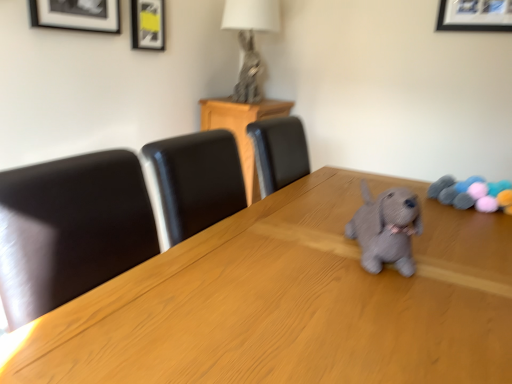
Image resolution: width=512 pixels, height=384 pixels. What do you see at coordinates (386, 229) in the screenshot? I see `gray knitted dog at center` at bounding box center [386, 229].

This screenshot has height=384, width=512. Find the location of `gray knitted dog at center`. gray knitted dog at center is located at coordinates (386, 229).

The height and width of the screenshot is (384, 512). I want to click on wooden table at center, so click(293, 303).

In order to face gray knitted stuffed animal at right, should I rotate leftwards or rightwards?

It's best to rotate right around 26.644 degrees.

Locate an element on the screen. This screenshot has width=512, height=384. gray knitted dog at center is located at coordinates tap(386, 229).

From a real-world perspective, is black leather chair at center beneath gray knitted stuffed animal at right?

Yes, from a real-world perspective, black leather chair at center is under gray knitted stuffed animal at right.

Which is correct: black leather chair at center is inside gray knitted stuffed animal at right, or outside of it?

black leather chair at center is not enclosed by gray knitted stuffed animal at right.

Is black leather chair at center bigger or smaller than gray knitted stuffed animal at right?

Clearly, black leather chair at center is larger in size than gray knitted stuffed animal at right.

Is black leather chair at center in front of or behind matte black picture frame at upper left, acting as the 1th picture frame starting from the back, in the image?

Clearly, black leather chair at center is in front of matte black picture frame at upper left, acting as the 1th picture frame starting from the back.

Is black leather chair at center positioned with its back to matte black picture frame at upper left, acting as the second picture frame starting from the front?

That's not correct — black leather chair at center is not looking away from matte black picture frame at upper left, acting as the second picture frame starting from the front.

At what (x,y) coordinates should I click in order to perform the action: click on the 2nd picture frame above when counting from the black leather chair at center (from the image's perspective). Please return your answer as a coordinate pair (x, y). The height and width of the screenshot is (384, 512). Looking at the image, I should click on (148, 24).

Consider the image. Is wooden table at center to the right of black leather chair at center from the viewer's perspective?

Yes.

Where is `chair that appears behind the wooden table at center`? The width and height of the screenshot is (512, 384). chair that appears behind the wooden table at center is located at coordinates (279, 152).

Based on the photo, is wooden table at center positioned with its back to black leather chair at center?

No, wooden table at center is not facing the opposite direction of black leather chair at center.

From a real-world perspective, is wooden table at center positioned above or below black leather chair at center?

wooden table at center is situated lower than black leather chair at center in the real world.

Considering the sizes of objects gray knitted stuffed animal at right and matte black picture frame at upper left, the 2th picture frame viewed from the back, in the image provided, who is taller, gray knitted stuffed animal at right or matte black picture frame at upper left, the 2th picture frame viewed from the back,?

With more height is matte black picture frame at upper left, the 2th picture frame viewed from the back.

Considering the relative positions of gray knitted stuffed animal at right and matte black picture frame at upper left, the 2th picture frame viewed from the back, in the image provided, is gray knitted stuffed animal at right to the right of matte black picture frame at upper left, the 2th picture frame viewed from the back, from the viewer's perspective?

Yes, gray knitted stuffed animal at right is to the right of matte black picture frame at upper left, the 2th picture frame viewed from the back.

From the image's perspective, which one is positioned lower, gray knitted stuffed animal at right or matte black picture frame at upper left, which is the first picture frame in front-to-back order?

From the image's view, gray knitted stuffed animal at right is below.

Would you say gray knitted dog at center is outside gray knitted stuffed animal at right?

gray knitted dog at center lies outside gray knitted stuffed animal at right's area.

Which is less distant, (370, 206) or (509, 188)?

Point (370, 206) is closer to the camera than point (509, 188).

You are a GUI agent. You are given a task and a screenshot of the screen. Output one action in this format:
    pyautogui.click(x=<x>, y=<y>)
    Task: Click on the dog below the gray knitted stuffed animal at right (from the image's perspective)
    The image size is (512, 384).
    Given the screenshot: What is the action you would take?
    tap(386, 229)

From the picture: From the image's perspective, would you say gray knitted dog at center is positioned over gray knitted stuffed animal at right?

No.

Who is bigger, black leather chair at center or gray knitted dog at center?

Bigger between the two is black leather chair at center.

How different are the orientations of black leather chair at center and gray knitted dog at center in degrees?

64.3 degrees.

Is gray knitted dog at center at the back of black leather chair at center?

No.

Who is taller, black leather chair at center or gray knitted dog at center?

black leather chair at center is taller.

Would you say wooden table at center is a long distance from matte black picture frame at upper left, which is the first picture frame in front-to-back order?

Indeed, wooden table at center is not near matte black picture frame at upper left, which is the first picture frame in front-to-back order.

Considering the relative sizes of wooden table at center and matte black picture frame at upper left, which ranks as the first picture frame in left-to-right order, in the image provided, is wooden table at center taller than matte black picture frame at upper left, which ranks as the first picture frame in left-to-right order,?

Indeed, wooden table at center has a greater height compared to matte black picture frame at upper left, which ranks as the first picture frame in left-to-right order.

Looking at this image, is wooden table at center positioned beyond the bounds of matte black picture frame at upper left, the second picture frame from the right?

Absolutely, wooden table at center is external to matte black picture frame at upper left, the second picture frame from the right.

Looking at this image, measure the distance from wooden table at center to matte black picture frame at upper left, the 2th picture frame viewed from the back.

wooden table at center and matte black picture frame at upper left, the 2th picture frame viewed from the back, are 4.33 feet apart.

This screenshot has width=512, height=384. In the image, there is a black leather chair at center. Identify the location of toy below it (from the image's perspective). (473, 193).

Find the location of a particular element. The image size is (512, 384). chair located in front of the matte black picture frame at upper left, which is counted as the 1th picture frame, starting from the right is located at coordinates (279, 152).

Consider the image. Considering their positions, is metallic silver rabbit at upper center positioned further to black leather chair at center than gray knitted dog at center?

metallic silver rabbit at upper center is further to black leather chair at center.

From the image, which object appears to be farther from black leather chair at center, matte black picture frame at upper left, the second picture frame from the right, or gray knitted dog at center?

matte black picture frame at upper left, the second picture frame from the right, lies further to black leather chair at center than the other object.

Estimate the real-world distances between objects in this image. Which object is closer to black leather chair at center, metallic silver rabbit at upper center or gray knitted stuffed animal at right?

Based on the image, gray knitted stuffed animal at right appears to be nearer to black leather chair at center.

Which object lies further to the anchor point matte black picture frame at upper left, acting as the 1th picture frame starting from the back, gray knitted dog at center or metallic silver rabbit at upper center?

gray knitted dog at center is further to matte black picture frame at upper left, acting as the 1th picture frame starting from the back.

Which object lies further to the anchor point black leather chair at center, gray knitted dog at center or gray knitted stuffed animal at right?

gray knitted stuffed animal at right.

When comparing their distances from matte black picture frame at upper left, which is counted as the 1th picture frame, starting from the right, does gray knitted stuffed animal at right or wooden table at center seem closer?

Based on the image, wooden table at center appears to be nearer to matte black picture frame at upper left, which is counted as the 1th picture frame, starting from the right.

Estimate the real-world distances between objects in this image. Which object is closer to matte black picture frame at upper left, arranged as the second picture frame when viewed from the left, metallic silver rabbit at upper center or wooden table at center?

metallic silver rabbit at upper center lies closer to matte black picture frame at upper left, arranged as the second picture frame when viewed from the left, than the other object.

Looking at the image, which one is located closer to matte black picture frame at upper left, the second picture frame from the right, matte black picture frame at upper left, acting as the 1th picture frame starting from the back, or black leather chair at center?

Based on the image, matte black picture frame at upper left, acting as the 1th picture frame starting from the back, appears to be nearer to matte black picture frame at upper left, the second picture frame from the right.

You are a GUI agent. You are given a task and a screenshot of the screen. Output one action in this format:
    pyautogui.click(x=<x>, y=<y>)
    Task: Click on the chair situated between matte black picture frame at upper left, the 2th picture frame viewed from the back, and gray knitted dog at center from left to right
    The width and height of the screenshot is (512, 384).
    Given the screenshot: What is the action you would take?
    pyautogui.click(x=279, y=152)

Where is `dog between matte black picture frame at upper left, which is the first picture frame in front-to-back order, and gray knitted stuffed animal at right, in the horizontal direction`? dog between matte black picture frame at upper left, which is the first picture frame in front-to-back order, and gray knitted stuffed animal at right, in the horizontal direction is located at coordinates (386, 229).

You are a GUI agent. You are given a task and a screenshot of the screen. Output one action in this format:
    pyautogui.click(x=<x>, y=<y>)
    Task: Click on the picture frame positioned between matte black picture frame at upper left, which ranks as the first picture frame in left-to-right order, and metallic silver rabbit at upper center from near to far
    The image size is (512, 384).
    Given the screenshot: What is the action you would take?
    pyautogui.click(x=148, y=24)

Image resolution: width=512 pixels, height=384 pixels. I want to click on chair situated between matte black picture frame at upper left, the 2th picture frame viewed from the back, and gray knitted stuffed animal at right from left to right, so click(x=279, y=152).